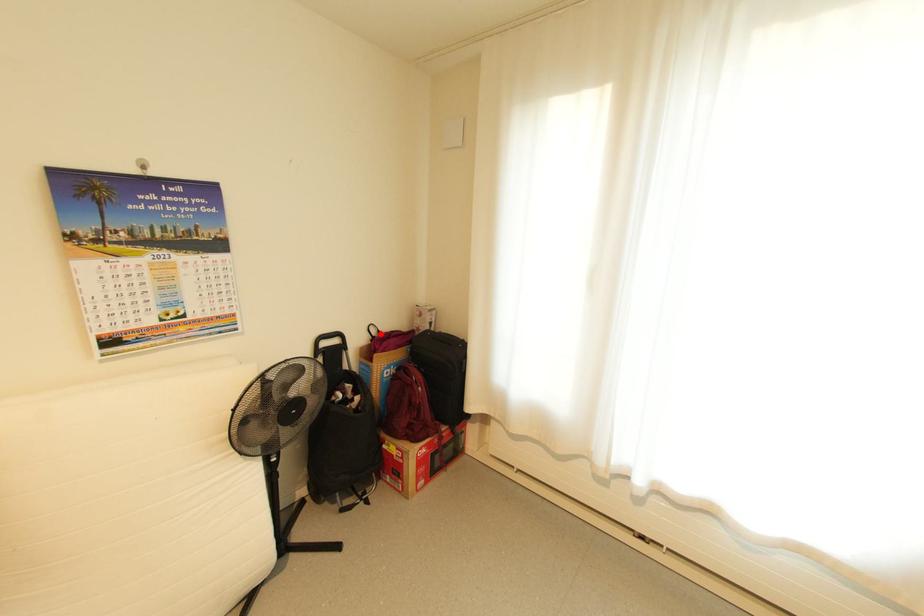
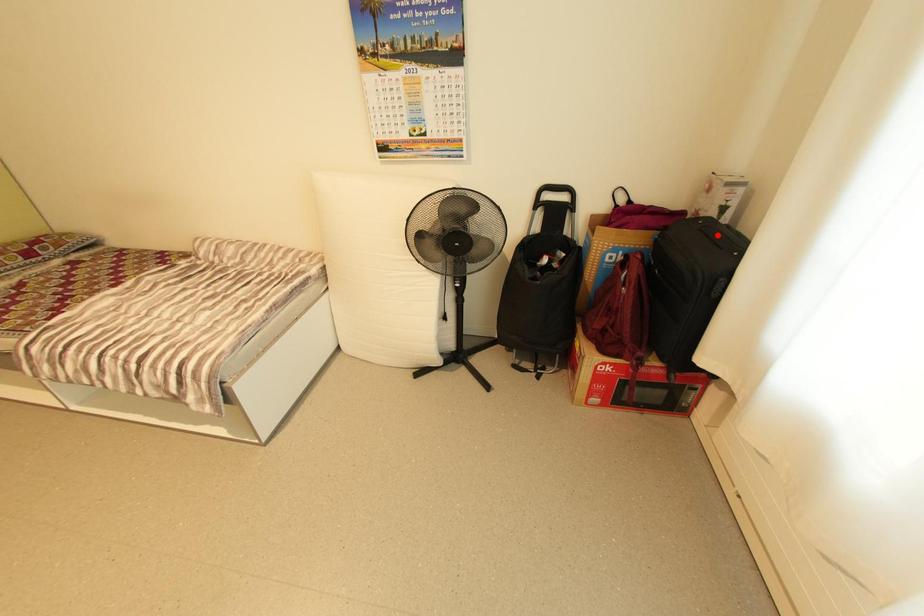
I am providing you with two images of the same scene from different viewpoints. A red point is marked on the first image and another point is marked on the second image. Does the point marked in image1 correspond to the same location as the one in image2?

No